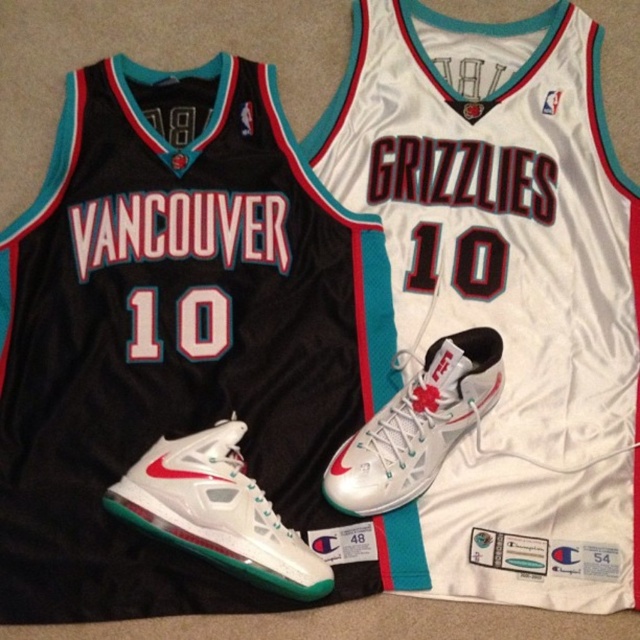
Question: Is white matte jersey at center thinner than metallic silver sneaker at center?

Choices:
 (A) no
 (B) yes

Answer: (A)

Question: Among these points, which one is farthest from the camera?

Choices:
 (A) (454, 404)
 (B) (570, 605)
 (C) (170, 512)

Answer: (A)

Question: Among these points, which one is farthest from the camera?

Choices:
 (A) (420, 448)
 (B) (284, 538)

Answer: (A)

Question: Does white mesh shoe at center have a smaller size compared to metallic silver sneaker at center?

Choices:
 (A) yes
 (B) no

Answer: (B)

Question: Which point is farther to the camera?

Choices:
 (A) white matte jersey at center
 (B) white mesh shoe at center

Answer: (B)

Question: Can you confirm if white matte jersey at center is positioned above metallic silver sneaker at center?

Choices:
 (A) yes
 (B) no

Answer: (A)